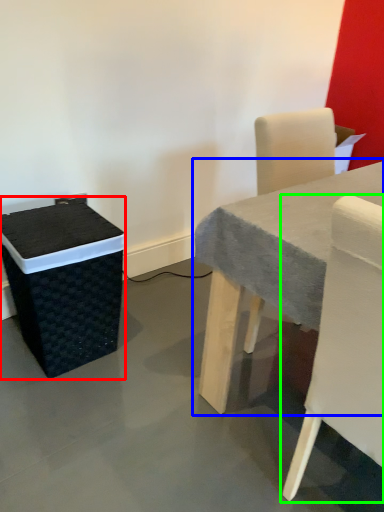
Question: Considering the real-world distances, which object is closest to storage box (highlighted by a red box)? table (highlighted by a blue box) or chair (highlighted by a green box).

Choices:
 (A) table
 (B) chair

Answer: (A)